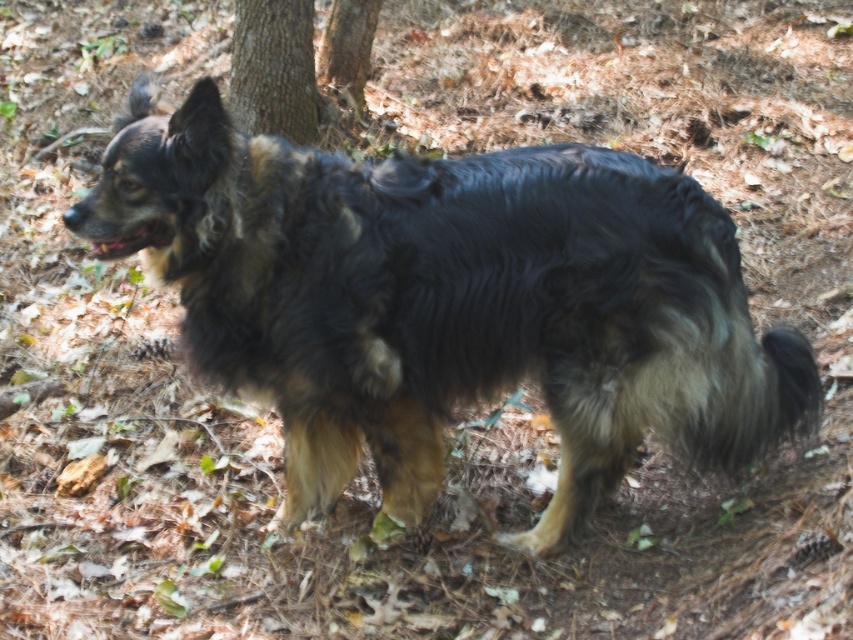
Between shaggy brown dog at center and brown rough bark at center, which one has more height?

shaggy brown dog at center is taller.

Is shaggy brown dog at center positioned behind brown rough bark at center?

No.

Who is more distant from viewer, (149,132) or (260,54)?

Positioned behind is point (260,54).

The image size is (853, 640). I want to click on shaggy brown dog at center, so click(x=450, y=301).

Does shaggy brown dog at center have a smaller size compared to brown rough bark at upper center?

Incorrect, shaggy brown dog at center is not smaller in size than brown rough bark at upper center.

Which is behind, point (242, 182) or point (357, 112)?

The point (357, 112) is more distant.

Find the location of a particular element. shaggy brown dog at center is located at coordinates (450, 301).

Does brown rough bark at center appear on the right side of brown rough bark at upper center?

In fact, brown rough bark at center is to the left of brown rough bark at upper center.

Can you confirm if brown rough bark at center is thinner than brown rough bark at upper center?

No, brown rough bark at center is not thinner than brown rough bark at upper center.

Which is in front, point (314, 83) or point (341, 10)?

Point (314, 83) is more forward.

Locate an element on the screen. The width and height of the screenshot is (853, 640). brown rough bark at center is located at coordinates (273, 68).